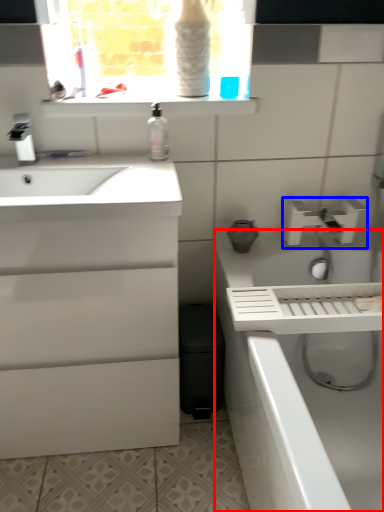
Question: Which object appears closest to the camera in this image, bath (highlighted by a red box) or tap (highlighted by a blue box)?

Choices:
 (A) bath
 (B) tap

Answer: (A)